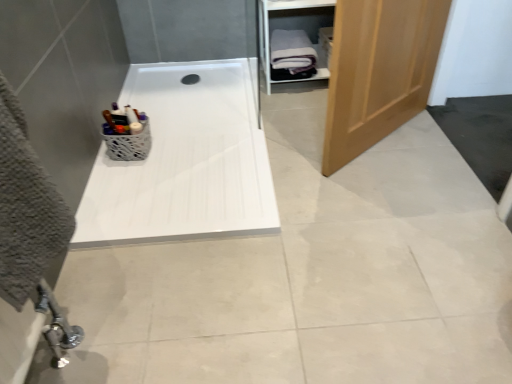
Question: Is white glossy bath at center positioned far away from white wood cabinet at upper right?

Choices:
 (A) yes
 (B) no

Answer: (B)

Question: Is white glossy bath at center to the right of white wood cabinet at upper right from the viewer's perspective?

Choices:
 (A) no
 (B) yes

Answer: (A)

Question: Is white glossy bath at center shorter than white wood cabinet at upper right?

Choices:
 (A) no
 (B) yes

Answer: (B)

Question: Considering the relative sizes of white glossy bath at center and white wood cabinet at upper right in the image provided, is white glossy bath at center taller than white wood cabinet at upper right?

Choices:
 (A) yes
 (B) no

Answer: (B)

Question: Is white glossy bath at center thinner than white wood cabinet at upper right?

Choices:
 (A) yes
 (B) no

Answer: (B)

Question: Does point (125, 157) appear closer or farther from the camera than point (305, 8)?

Choices:
 (A) closer
 (B) farther

Answer: (A)

Question: From a real-world perspective, is white textured basket at upper left physically located above or below white wood cabinet at upper right?

Choices:
 (A) above
 (B) below

Answer: (B)

Question: Is white textured basket at upper left spatially inside white wood cabinet at upper right, or outside of it?

Choices:
 (A) inside
 (B) outside

Answer: (B)

Question: In terms of size, does white textured basket at upper left appear bigger or smaller than white wood cabinet at upper right?

Choices:
 (A) big
 (B) small

Answer: (B)

Question: From the image's perspective, relative to white textured basket at upper left, is white glossy bath at center above or below?

Choices:
 (A) below
 (B) above

Answer: (B)

Question: Considering their positions, is white glossy bath at center located in front of or behind white textured basket at upper left?

Choices:
 (A) behind
 (B) front

Answer: (B)

Question: Considering the positions of white glossy bath at center and white textured basket at upper left in the image, is white glossy bath at center wider or thinner than white textured basket at upper left?

Choices:
 (A) thin
 (B) wide

Answer: (B)

Question: From a real-world perspective, is white glossy bath at center physically located above or below white textured basket at upper left?

Choices:
 (A) above
 (B) below

Answer: (B)

Question: From the image's perspective, is wooden door at right positioned above or below white soft towel at upper right?

Choices:
 (A) below
 (B) above

Answer: (A)

Question: Relative to white soft towel at upper right, is wooden door at right in front or behind?

Choices:
 (A) front
 (B) behind

Answer: (A)